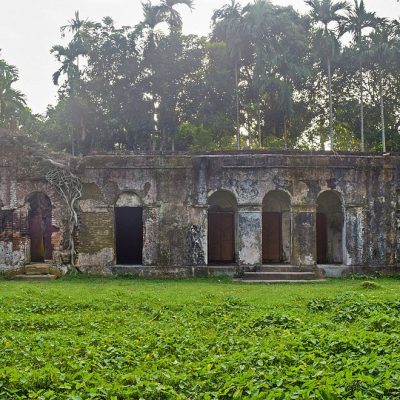
You are a GUI agent. You are given a task and a screenshot of the screen. Output one action in this format:
    pyautogui.click(x=<x>, y=<y>)
    Task: Click on the archway
    The height and width of the screenshot is (400, 400).
    Given the screenshot: What is the action you would take?
    click(40, 192), click(129, 193), click(277, 194), click(332, 194), click(222, 192)